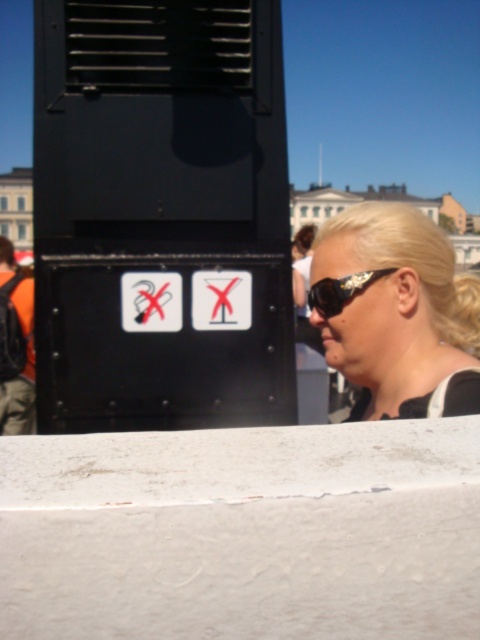
Can you confirm if white concrete ledge at lower center is positioned to the right of gold textured sunglasses at upper right?

No, white concrete ledge at lower center is not to the right of gold textured sunglasses at upper right.

Is white concrete ledge at lower center taller than gold textured sunglasses at upper right?

Yes.

Does point (86, 614) lie in front of point (324, 301)?

Yes, point (86, 614) is in front of point (324, 301).

Identify the location of white concrete ledge at lower center. (242, 532).

Does blonde hair at upper right have a greater width compared to gold textured sunglasses at upper right?

Yes, blonde hair at upper right is wider than gold textured sunglasses at upper right.

Does point (466, 337) come behind point (319, 291)?

Yes, point (466, 337) is behind point (319, 291).

I want to click on blonde hair at upper right, so click(396, 312).

Does white concrete ledge at lower center have a lesser width compared to blonde hair at upper right?

In fact, white concrete ledge at lower center might be wider than blonde hair at upper right.

Does white concrete ledge at lower center have a smaller size compared to blonde hair at upper right?

No.

Between point (323, 570) and point (453, 410), which one is positioned behind?

The point (453, 410) is behind.

At what (x,y) coordinates should I click in order to perform the action: click on white concrete ledge at lower center. Please return your answer as a coordinate pair (x, y). Looking at the image, I should click on (242, 532).